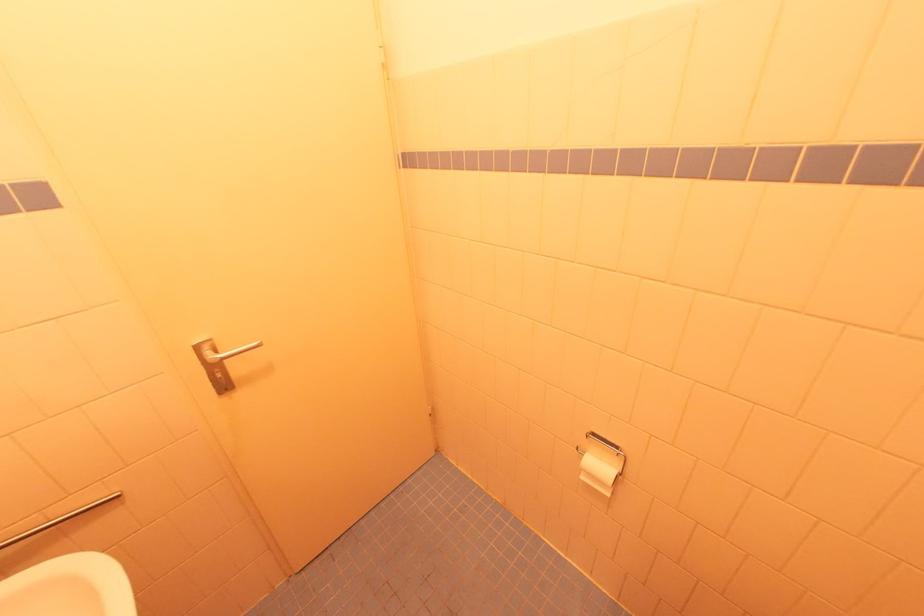
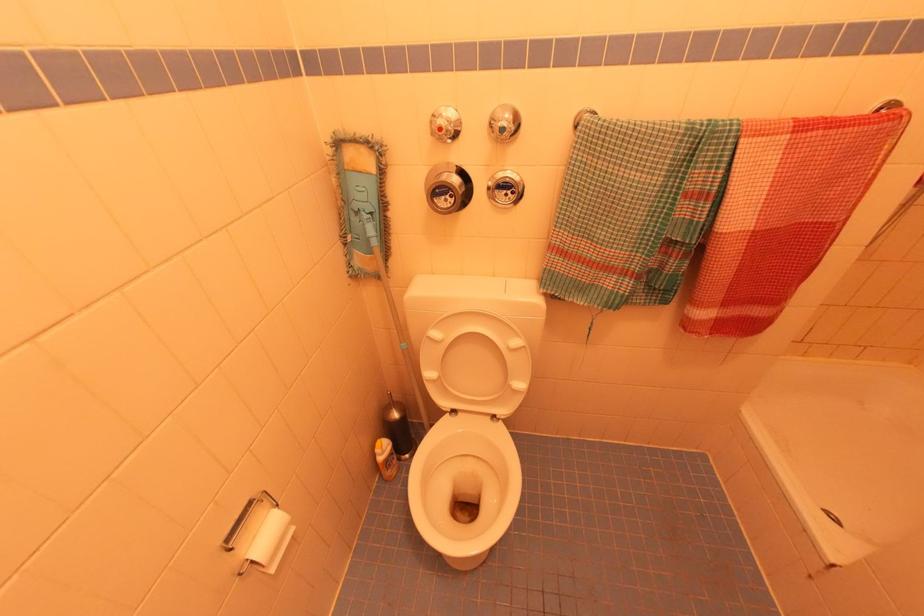
Where in the second image is the point corresponding to (585,479) from the first image?

(274, 570)